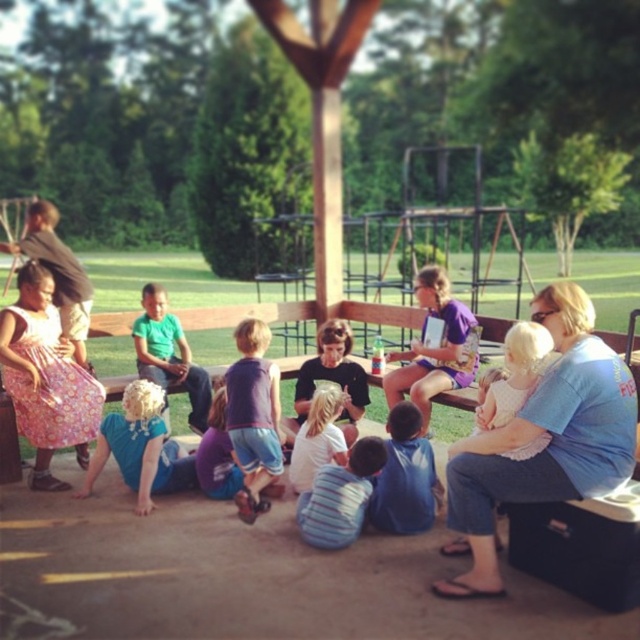
You are a photographer positioned at the back of the group. You want to take a photo that includes both the blue cotton shirt at center and the matte black shirt at center. Which one should you adjust your position to ensure both are fully visible in the frame?

The blue cotton shirt at center is in front of the matte black shirt at center. To ensure both are fully visible, you should move your position slightly to the side so that you can see around the blue cotton shirt at center to include the matte black shirt at center behind it.

You are a photographer standing at the edge of the scene. You want to take a photo that includes both the blue fabric shirt at lower left and the green matte shirt at center. What is the minimum distance you need to move backward to ensure both are fully visible in your frame?

The blue fabric shirt at lower left and green matte shirt at center are 26.73 inches apart. To capture both in the frame, you need to move backward until your camera can cover at least 26.73 inches horizontally. The exact distance depends on your camera lens, but moving back by approximately 3 feet should help ensure both subjects are visible.

Looking at this image, you are a photographer trying to capture a group photo of the striped shirt at lower center and the white lace dress at center. Based on their positions, which subject should you focus on first to ensure both are in frame?

The striped shirt at lower center is wider than the white lace dress at center, so focus on the striped shirt at lower center first to accommodate its width and ensure both are in frame.